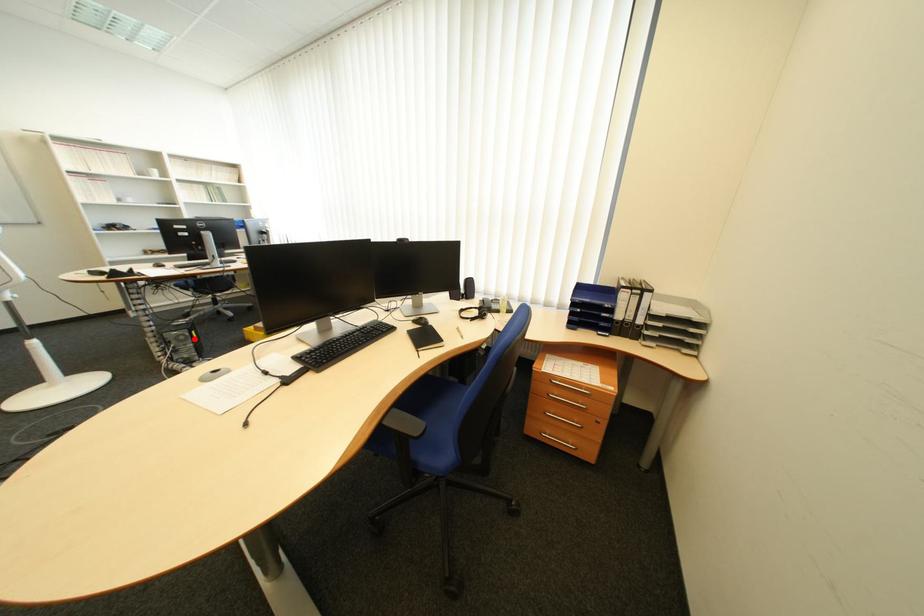
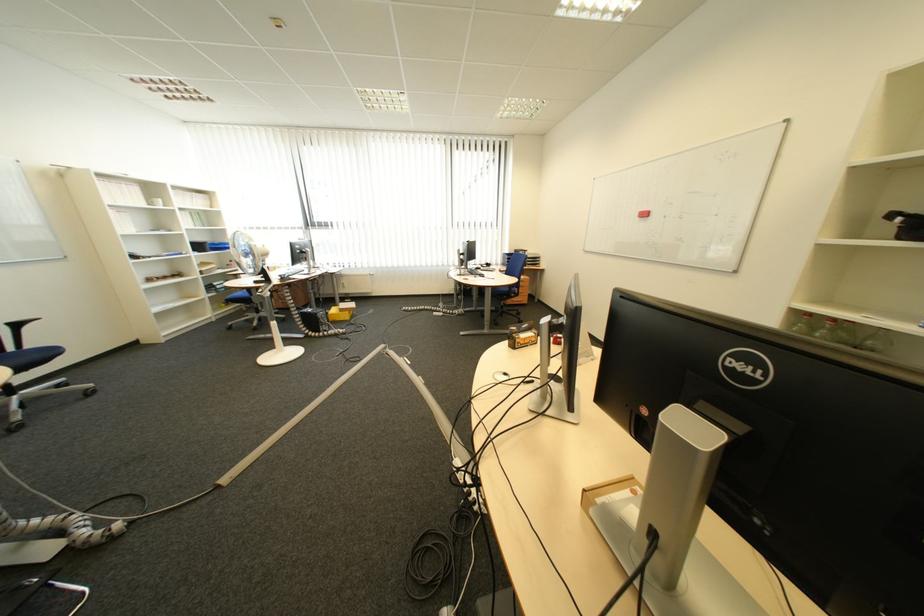
Question: A red point is marked in image1. In image2, is the corresponding 3D point closer to the camera or farther? Reply with the corresponding letter.

Choices:
 (A) The corresponding 3D point is closer.
 (B) The corresponding 3D point is farther.

Answer: (A)